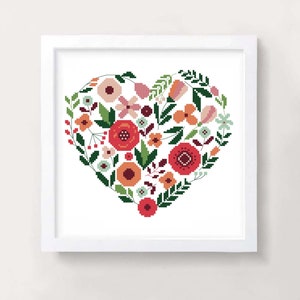
Image resolution: width=300 pixels, height=300 pixels. Find the location of `frame`. frame is located at coordinates (249, 240).